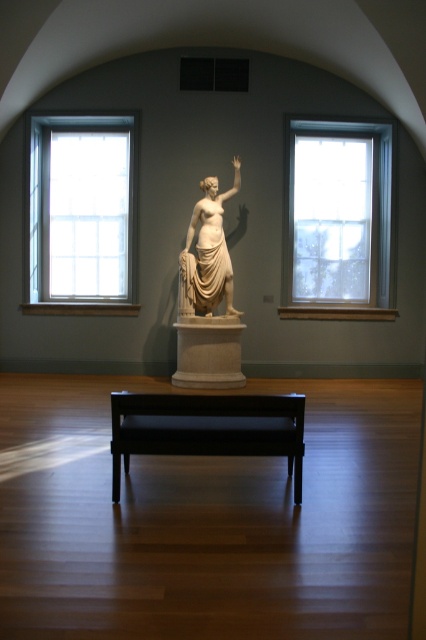
Question: Is clear glass window at left wider than white marble pedestal at center?

Choices:
 (A) no
 (B) yes

Answer: (B)

Question: Among these points, which one is farthest from the camera?

Choices:
 (A) (213, 266)
 (B) (354, 145)
 (C) (192, 340)
 (D) (267, 449)

Answer: (B)

Question: Which of the following is the farthest from the observer?

Choices:
 (A) (218, 259)
 (B) (29, 205)

Answer: (B)

Question: Which point appears farthest from the camera in this image?

Choices:
 (A) (294, 157)
 (B) (112, 168)

Answer: (B)

Question: Does clear glass window at right appear on the left side of white marble pedestal at center?

Choices:
 (A) no
 (B) yes

Answer: (A)

Question: Is clear glass window at left further to the viewer compared to white marble statue at center?

Choices:
 (A) yes
 (B) no

Answer: (A)